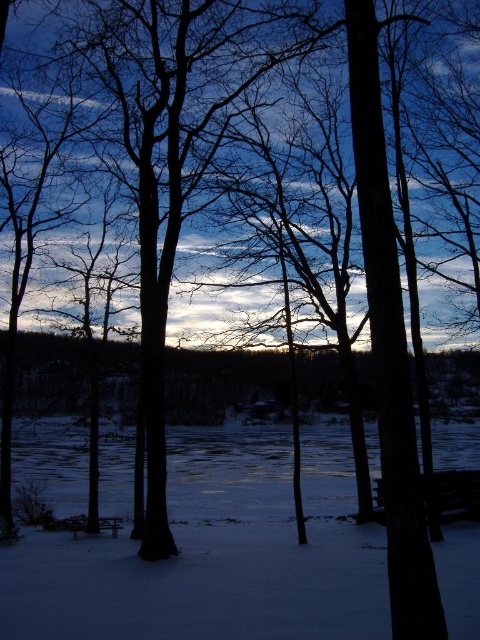
Question: Does white powdery snow at center have a greater width compared to wooden park bench at lower center?

Choices:
 (A) yes
 (B) no

Answer: (A)

Question: Does white powdery snow at center have a larger size compared to wooden park bench at lower center?

Choices:
 (A) yes
 (B) no

Answer: (A)

Question: Does white powdery snow at center have a greater width compared to wooden park bench at lower center?

Choices:
 (A) yes
 (B) no

Answer: (A)